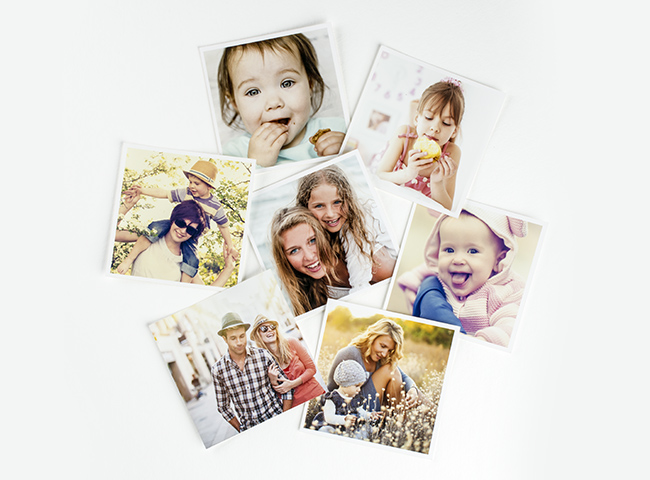
The width and height of the screenshot is (650, 480). Identify the location of pictures in the collage with kids. (270, 91), (326, 209), (389, 377), (457, 258).